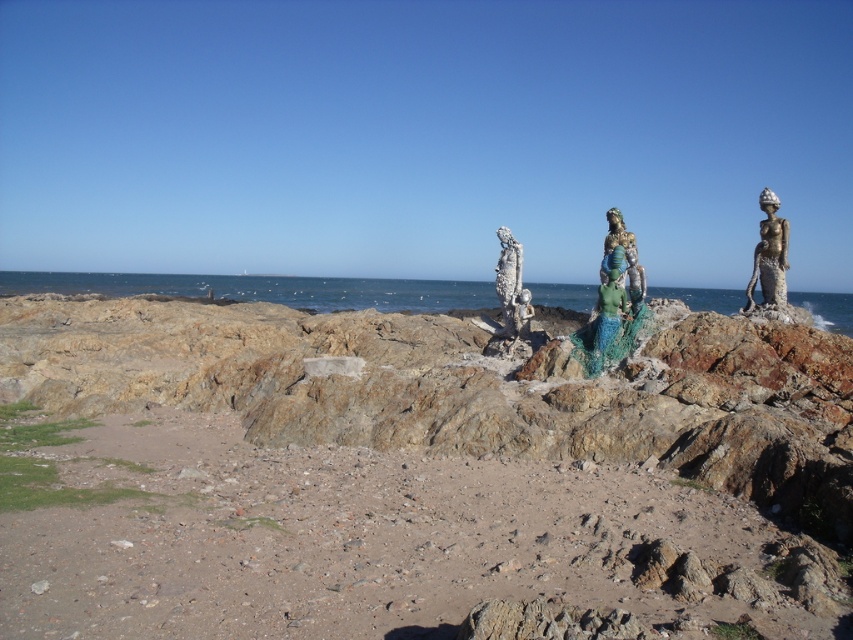
Question: Which point is farther from the camera taking this photo?

Choices:
 (A) (637, 262)
 (B) (514, 305)

Answer: (B)

Question: Which object is positioned farthest from the rusty metal statue at center?

Choices:
 (A) brown sandy beach at lower left
 (B) green patina statue at center
 (C) shiny bronze mermaid at right

Answer: (A)

Question: Is shiny bronze mermaid at right smaller than green patina statue at center?

Choices:
 (A) no
 (B) yes

Answer: (A)

Question: Does rusty metal statue at center have a larger size compared to shiny bronze mermaid at right?

Choices:
 (A) yes
 (B) no

Answer: (B)

Question: Which of the following is the closest to the observer?

Choices:
 (A) shiny bronze mermaid at right
 (B) green patina statue at center
 (C) clear blue water at center

Answer: (B)

Question: Is the position of shiny bronze mermaid at right less distant than that of green fabric mermaid at center?

Choices:
 (A) yes
 (B) no

Answer: (B)